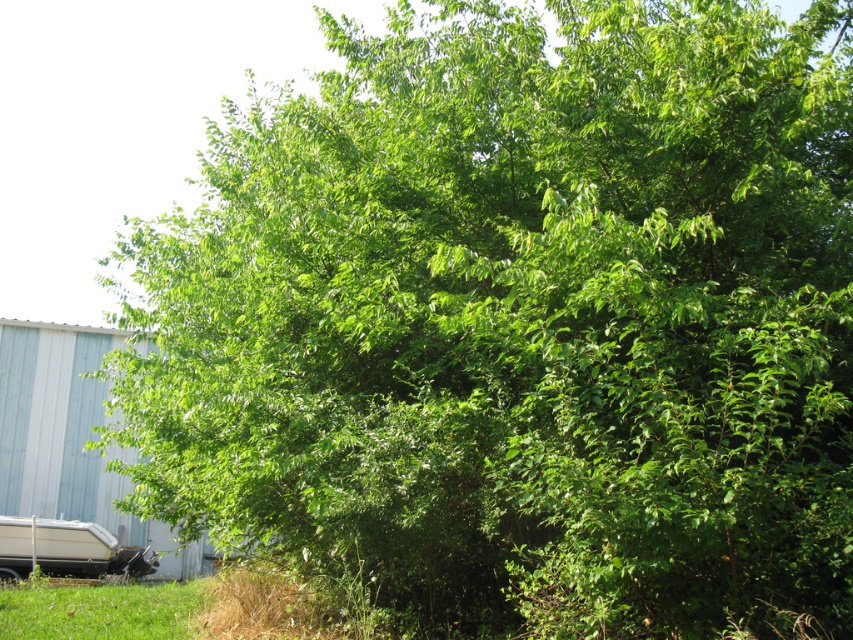
Is green grass at lower left to the left of white glossy boat at lower left from the viewer's perspective?

In fact, green grass at lower left is to the right of white glossy boat at lower left.

Who is positioned more to the right, green grass at lower left or white glossy boat at lower left?

green grass at lower left

The width and height of the screenshot is (853, 640). What do you see at coordinates (100, 611) in the screenshot?
I see `green grass at lower left` at bounding box center [100, 611].

Find the location of a particular element. green grass at lower left is located at coordinates coord(100,611).